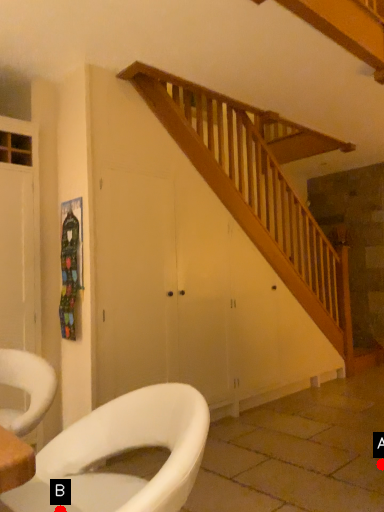
Question: Two points are circled on the image, labeled by A and B beside each circle. Which point is further to the camera?

Choices:
 (A) A is further
 (B) B is further

Answer: (A)